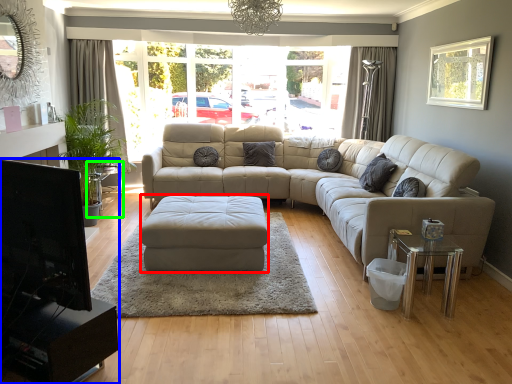
Question: Based on their relative distances, which object is nearer to footrest (highlighted by a red box)? Choose from entertainment center (highlighted by a blue box) and side table (highlighted by a green box).

Choices:
 (A) entertainment center
 (B) side table

Answer: (A)